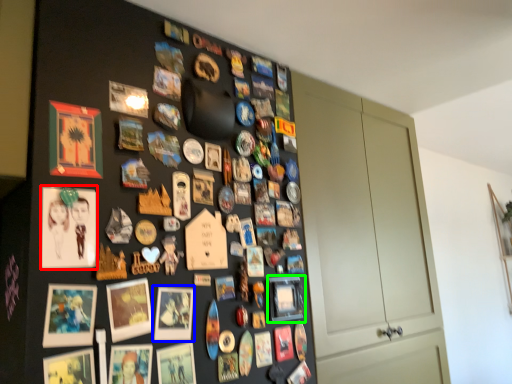
Question: Considering the real-world distances, which object is farthest from picture frame (highlighted by a red box)? picture frame (highlighted by a blue box) or picture frame (highlighted by a green box)?

Choices:
 (A) picture frame
 (B) picture frame

Answer: (B)